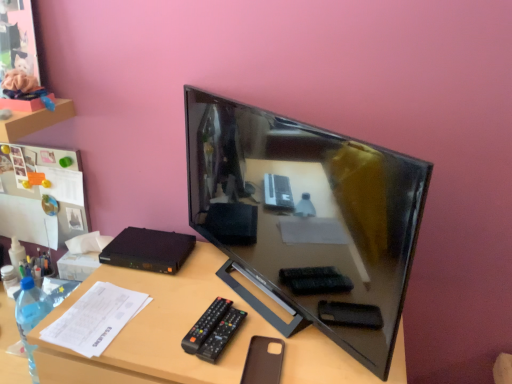
The width and height of the screenshot is (512, 384). In order to click on vacant space behind black plastic remote at lower center in this screenshot , I will do `click(219, 288)`.